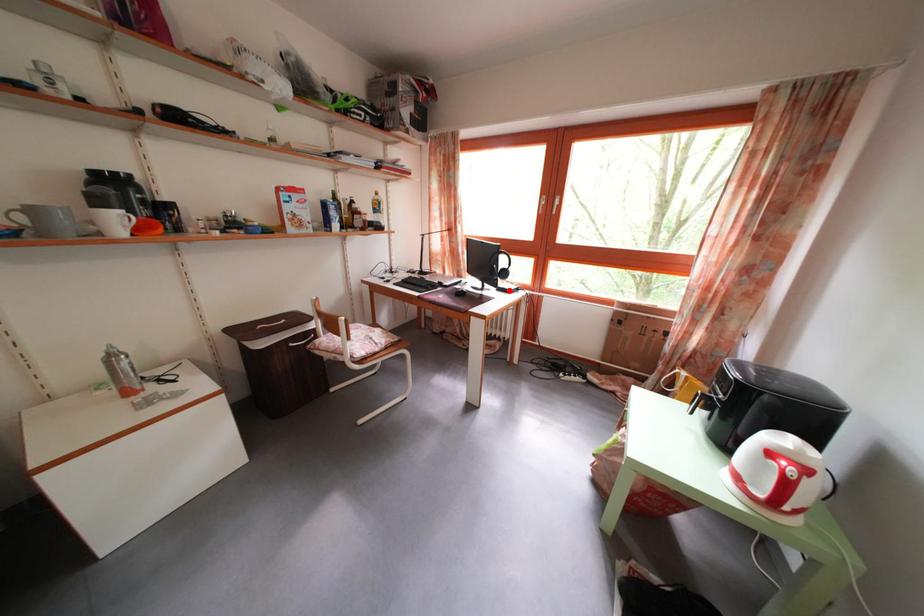
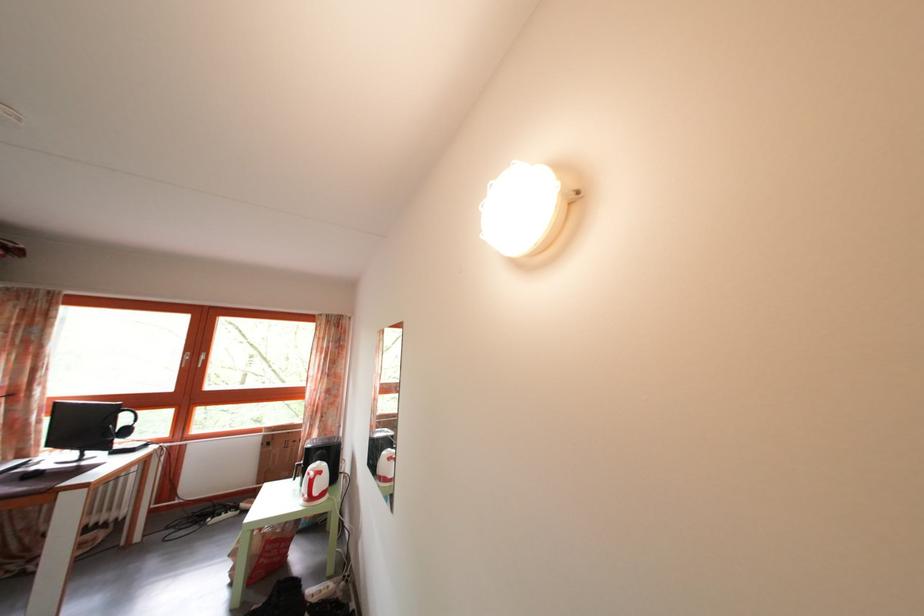
Locate, in the second image, the point that corresponds to the highlighted location in the first image.

(128, 451)